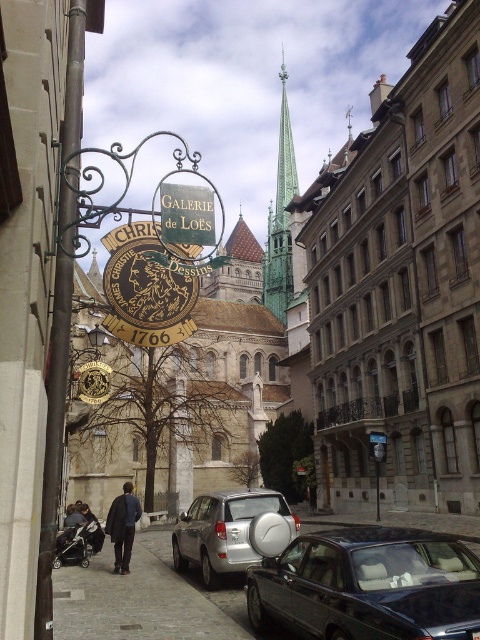
Is stone church at center positioned at the back of green wood sign at center?

Yes, stone church at center is behind green wood sign at center.

Which is more to the left, stone church at center or green wood sign at center?

From the viewer's perspective, green wood sign at center appears more on the left side.

This screenshot has width=480, height=640. What are the coordinates of `stone church at center` in the screenshot? It's located at (402, 284).

What are the coordinates of `stone church at center` in the screenshot? It's located at (402, 284).

Between silver metallic suv at center and green stone spire at upper center, which one appears on the right side from the viewer's perspective?

green stone spire at upper center is more to the right.

Who is lower down, silver metallic suv at center or green stone spire at upper center?

silver metallic suv at center

Between point (216, 556) and point (285, 180), which one is positioned in front?

Point (216, 556) is in front.

At what (x,y) coordinates should I click in order to perform the action: click on silver metallic suv at center. Please return your answer as a coordinate pair (x, y). This screenshot has width=480, height=640. Looking at the image, I should click on (224, 531).

Is stone church at center thinner than wooden signboard at center?

In fact, stone church at center might be wider than wooden signboard at center.

Between point (375, 353) and point (381, 445), which one is positioned in front?

Positioned in front is point (381, 445).

This screenshot has width=480, height=640. In order to click on stone church at center in this screenshot , I will do `click(402, 284)`.